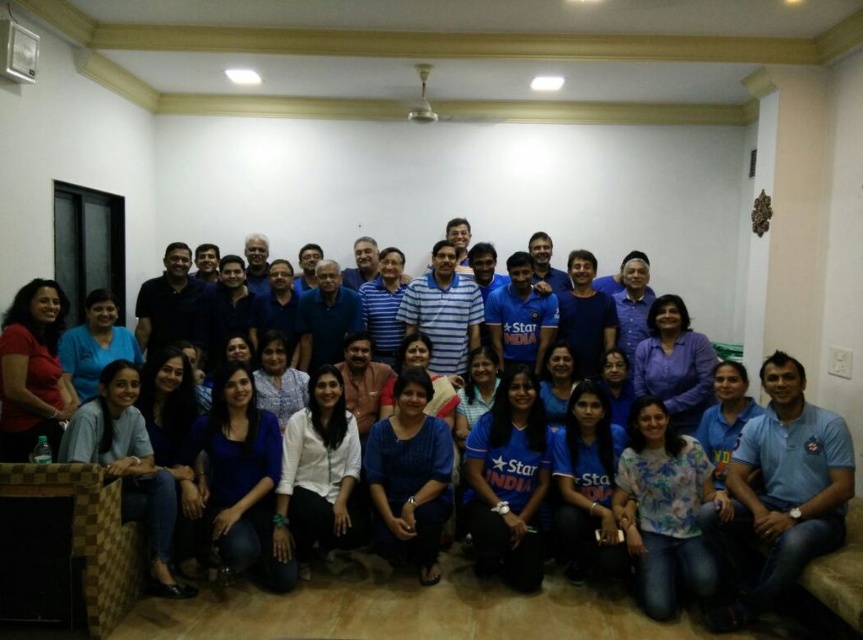
Does blue cotton shirt at center have a smaller size compared to blue cotton polo shirt at lower right?

Correct, blue cotton shirt at center occupies less space than blue cotton polo shirt at lower right.

Which is more to the right, blue cotton shirt at center or blue cotton polo shirt at lower right?

Positioned to the right is blue cotton polo shirt at lower right.

Is point (206, 624) positioned in front of point (824, 410)?

Yes, it is.

I want to click on blue cotton shirt at center, so click(414, 612).

Can you confirm if blue cotton shirt at center is positioned to the left of matte red shirt at left?

No, blue cotton shirt at center is not to the left of matte red shirt at left.

Who is more forward, (x=580, y=596) or (x=20, y=356)?

Point (x=20, y=356) is more forward.

Describe the element at coordinates (414, 612) in the screenshot. I see `blue cotton shirt at center` at that location.

I want to click on blue cotton shirt at center, so click(x=414, y=612).

Between blue cotton polo shirt at lower right and matte red shirt at left, which one appears on the right side from the viewer's perspective?

Positioned to the right is blue cotton polo shirt at lower right.

This screenshot has width=863, height=640. Identify the location of blue cotton polo shirt at lower right. (782, 492).